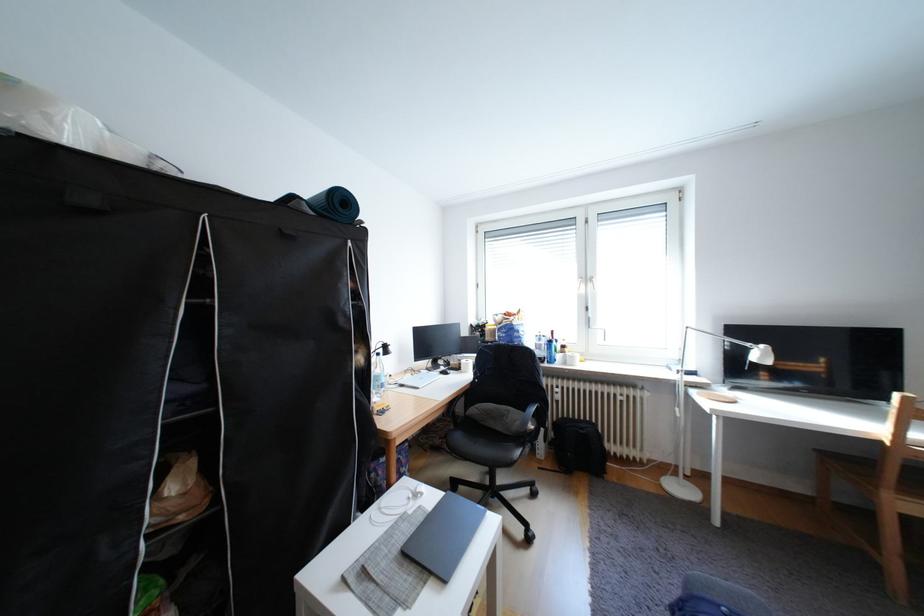
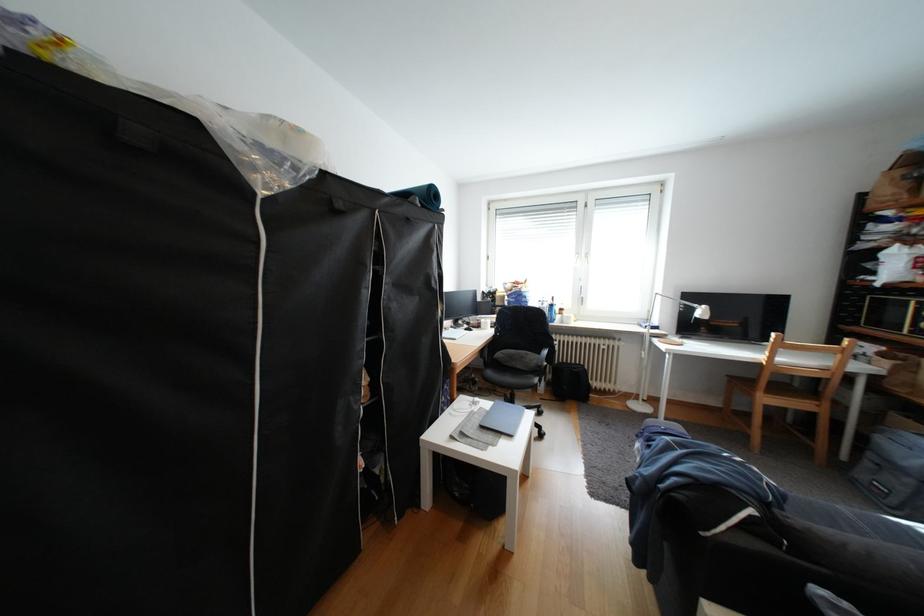
Question: The first image is from the beginning of the video and the second image is from the end. How did the camera likely rotate when shooting the video?

Choices:
 (A) Left
 (B) Right
 (C) Up
 (D) Down

Answer: (D)